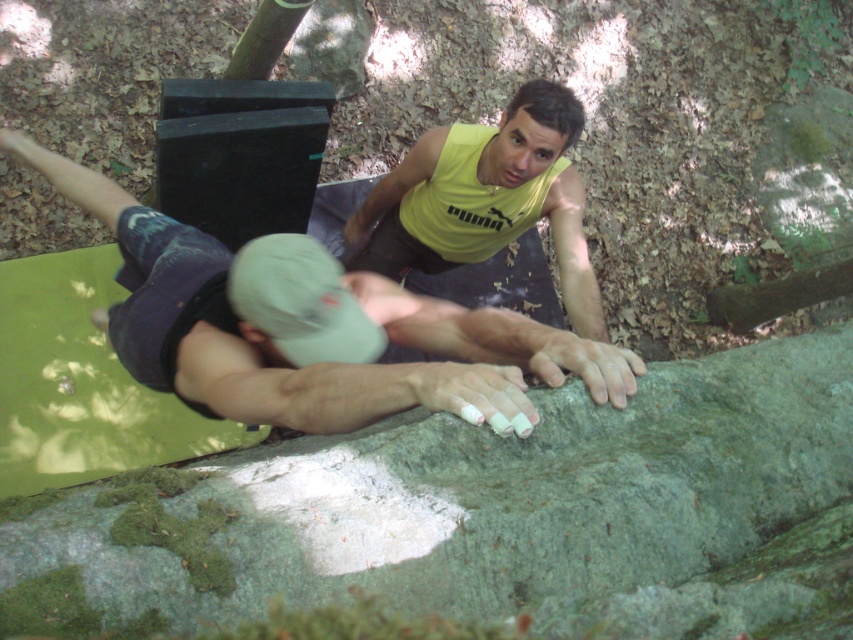
You are a photographer standing at the camera position. You want to take a photo of the point at coordinates point (508, 324). The focus range of your camera is set to 5 feet. Will the point be in focus?

The distance of point (508, 324) from camera is 5.19 feet. Since the focus range is set to 5 feet, the point is slightly out of focus. Adjust the focus range to at least 5.19 feet for clarity.